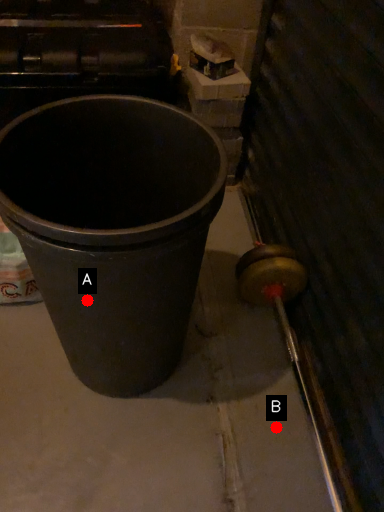
Question: Two points are circled on the image, labeled by A and B beside each circle. Which point appears closest to the camera in this image?

Choices:
 (A) A is closer
 (B) B is closer

Answer: (A)